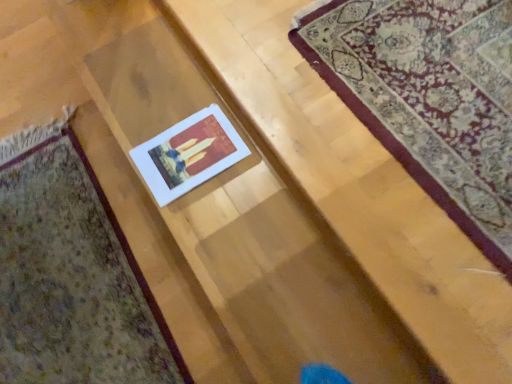
Where is `free point above white paper at center (from a real-world perspective)`? free point above white paper at center (from a real-world perspective) is located at coordinates (193, 151).